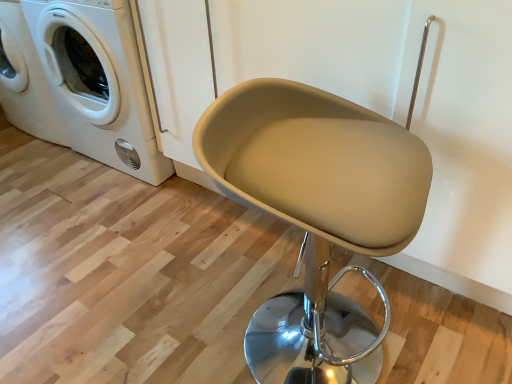
This screenshot has width=512, height=384. What are the coordinates of `beige fabric swivel chair at center` in the screenshot? It's located at (316, 214).

The image size is (512, 384). What do you see at coordinates (316, 214) in the screenshot? I see `beige fabric swivel chair at center` at bounding box center [316, 214].

The image size is (512, 384). What do you see at coordinates (98, 82) in the screenshot?
I see `white glossy washing machine at upper left` at bounding box center [98, 82].

The width and height of the screenshot is (512, 384). What are the coordinates of `white glossy washing machine at upper left` in the screenshot? It's located at (98, 82).

At what (x,y) coordinates should I click in order to perform the action: click on beige fabric swivel chair at center. Please return your answer as a coordinate pair (x, y). This screenshot has width=512, height=384. Looking at the image, I should click on coord(316,214).

Between beige fabric swivel chair at center and white glossy washing machine at upper left, which one appears on the right side from the viewer's perspective?

beige fabric swivel chair at center.

Considering their positions, is beige fabric swivel chair at center located in front of or behind white glossy washing machine at upper left?

Clearly, beige fabric swivel chair at center is in front of white glossy washing machine at upper left.

Is point (219, 177) positioned before point (73, 26)?

Yes, it is.

From the image's perspective, does beige fabric swivel chair at center appear lower than white glossy washing machine at upper left?

Correct, beige fabric swivel chair at center appears lower than white glossy washing machine at upper left in the image.

From a real-world perspective, does beige fabric swivel chair at center sit lower than white glossy washing machine at upper left?

Yes, from a real-world perspective, beige fabric swivel chair at center is beneath white glossy washing machine at upper left.

Looking at their sizes, would you say beige fabric swivel chair at center is wider or thinner than white glossy washing machine at upper left?

In the image, beige fabric swivel chair at center appears to be more narrow than white glossy washing machine at upper left.

Which of these two, beige fabric swivel chair at center or white glossy washing machine at upper left, stands shorter?

With less height is beige fabric swivel chair at center.

Which of these two, beige fabric swivel chair at center or white glossy washing machine at upper left, is smaller?

Smaller between the two is beige fabric swivel chair at center.

Is beige fabric swivel chair at center situated inside white glossy washing machine at upper left or outside?

beige fabric swivel chair at center is located beyond the bounds of white glossy washing machine at upper left.

Is beige fabric swivel chair at center next to white glossy washing machine at upper left?

No, beige fabric swivel chair at center is not beside white glossy washing machine at upper left.

Is beige fabric swivel chair at center turned away from white glossy washing machine at upper left?

That's not correct — beige fabric swivel chair at center is not looking away from white glossy washing machine at upper left.

What's the angular difference between beige fabric swivel chair at center and white glossy washing machine at upper left's facing directions?

There is a 98.3-degree angle between the facing directions of beige fabric swivel chair at center and white glossy washing machine at upper left.

Measure the distance between beige fabric swivel chair at center and white glossy washing machine at upper left.

They are 3.37 feet apart.

Locate an element on the screen. swivel chair in front of the white glossy washing machine at upper left is located at coordinates (316, 214).

Can you confirm if white glossy washing machine at upper left is positioned to the left of beige fabric swivel chair at center?

Yes, white glossy washing machine at upper left is to the left of beige fabric swivel chair at center.

Which object is closer to the camera, white glossy washing machine at upper left or beige fabric swivel chair at center?

Positioned in front is beige fabric swivel chair at center.

Does point (142, 116) come in front of point (323, 296)?

No, it is behind (323, 296).

From the image's perspective, is white glossy washing machine at upper left above beige fabric swivel chair at center?

Indeed, from the image's perspective, white glossy washing machine at upper left is shown above beige fabric swivel chair at center.

From a real-world perspective, which is physically below, white glossy washing machine at upper left or beige fabric swivel chair at center?

From a 3D spatial view, beige fabric swivel chair at center is below.

Considering the relative sizes of white glossy washing machine at upper left and beige fabric swivel chair at center in the image provided, is white glossy washing machine at upper left thinner than beige fabric swivel chair at center?

Incorrect, the width of white glossy washing machine at upper left is not less than that of beige fabric swivel chair at center.

Considering the relative sizes of white glossy washing machine at upper left and beige fabric swivel chair at center in the image provided, is white glossy washing machine at upper left taller than beige fabric swivel chair at center?

Indeed, white glossy washing machine at upper left has a greater height compared to beige fabric swivel chair at center.

Based on their sizes in the image, would you say white glossy washing machine at upper left is bigger or smaller than beige fabric swivel chair at center?

Considering their sizes, white glossy washing machine at upper left takes up more space than beige fabric swivel chair at center.

Is white glossy washing machine at upper left not inside beige fabric swivel chair at center?

Yes, white glossy washing machine at upper left is outside of beige fabric swivel chair at center.

Is white glossy washing machine at upper left next to beige fabric swivel chair at center and touching it?

white glossy washing machine at upper left and beige fabric swivel chair at center are not in contact.

Could you tell me if white glossy washing machine at upper left is facing beige fabric swivel chair at center?

No, white glossy washing machine at upper left is not facing towards beige fabric swivel chair at center.

How different are the orientations of white glossy washing machine at upper left and beige fabric swivel chair at center in degrees?

The facing directions of white glossy washing machine at upper left and beige fabric swivel chair at center are 98.3 degrees apart.

Where is `swivel chair that appears on the right of white glossy washing machine at upper left`? The image size is (512, 384). swivel chair that appears on the right of white glossy washing machine at upper left is located at coordinates (316, 214).

In the image, there is a beige fabric swivel chair at center. Where is `washing machine above it (from the image's perspective)`? washing machine above it (from the image's perspective) is located at coordinates (98, 82).

You are a GUI agent. You are given a task and a screenshot of the screen. Output one action in this format:
    pyautogui.click(x=<x>, y=<y>)
    Task: Click on the washing machine on the left side of beige fabric swivel chair at center
    
    Given the screenshot: What is the action you would take?
    pyautogui.click(x=98, y=82)